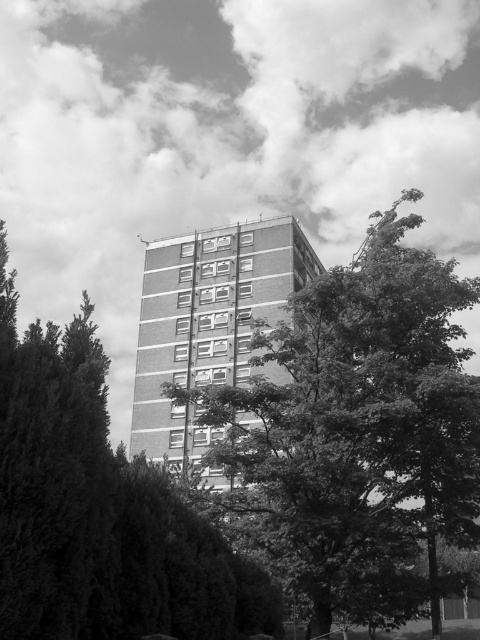
Question: Which point is farther to the camera?

Choices:
 (A) (262, 612)
 (B) (327, 432)

Answer: (A)

Question: Can you confirm if dark green leafy tree at center is positioned above green leafy tree at center?

Choices:
 (A) no
 (B) yes

Answer: (A)

Question: Which object appears farthest from the camera in this image?

Choices:
 (A) green leafy tree at center
 (B) dark green leafy tree at center

Answer: (B)

Question: Is dark green leafy tree at center below green leafy tree at center?

Choices:
 (A) yes
 (B) no

Answer: (A)

Question: Is dark green leafy tree at center positioned at the back of green leafy tree at center?

Choices:
 (A) no
 (B) yes

Answer: (B)

Question: Which object appears farthest from the camera in this image?

Choices:
 (A) green leafy tree at center
 (B) dark green leafy tree at center

Answer: (B)